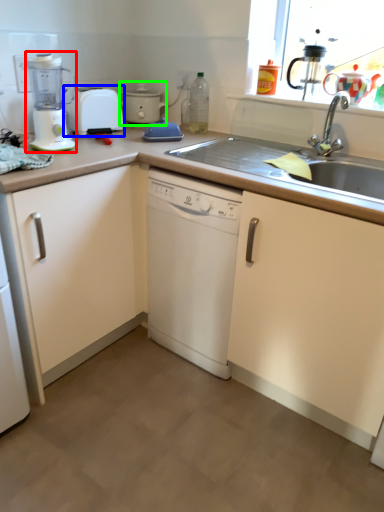
Question: Based on their relative distances, which object is nearer to kitchen appliance (highlighted by a red box)? Choose from toaster (highlighted by a blue box) and cooker (highlighted by a green box).

Choices:
 (A) toaster
 (B) cooker

Answer: (A)